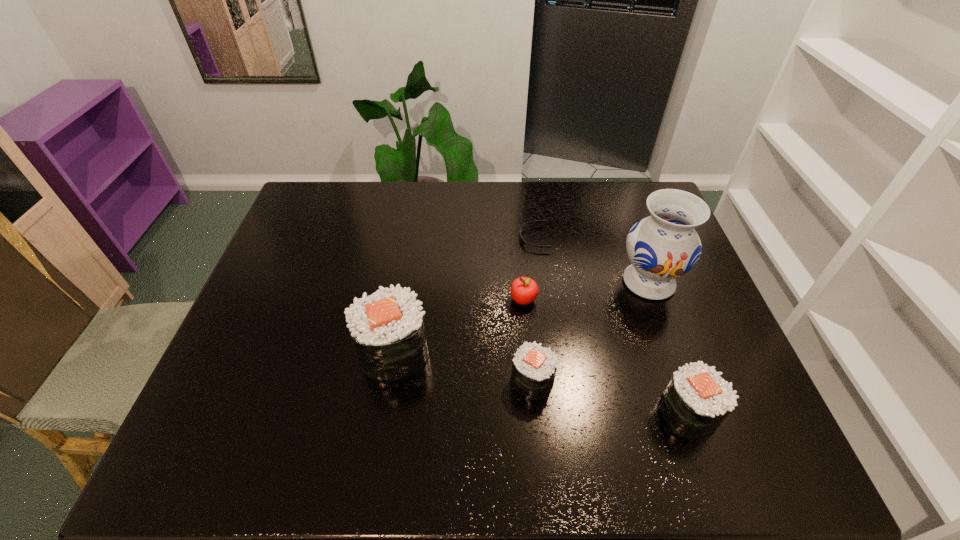
Locate an element on the screen. The height and width of the screenshot is (540, 960). the tallest sushi is located at coordinates (387, 327).

What are the coordinates of `the fifth shortest object` in the screenshot? It's located at (387, 327).

Where is `the second sushi from right to left`? the second sushi from right to left is located at coordinates (534, 367).

What are the coordinates of `the rightmost sushi` in the screenshot? It's located at (697, 399).

Find the location of a particular element. The image size is (960, 540). the fourth shortest object is located at coordinates (697, 399).

Where is `sunglasses`? Image resolution: width=960 pixels, height=540 pixels. sunglasses is located at coordinates (522, 240).

You are a GUI agent. You are given a task and a screenshot of the screen. Output one action in this format:
    pyautogui.click(x=<x>, y=<y>)
    Task: Click on the farthest object
    This screenshot has width=960, height=540.
    Given the screenshot: What is the action you would take?
    pyautogui.click(x=522, y=240)

Locate an element on the screen. the tallest object is located at coordinates (664, 246).

Locate an element on the screen. Image resolution: width=960 pixels, height=540 pixels. apple is located at coordinates (524, 290).

In order to click on vacant space situated on the back of the tallest sushi in this screenshot , I will do pos(412,239).